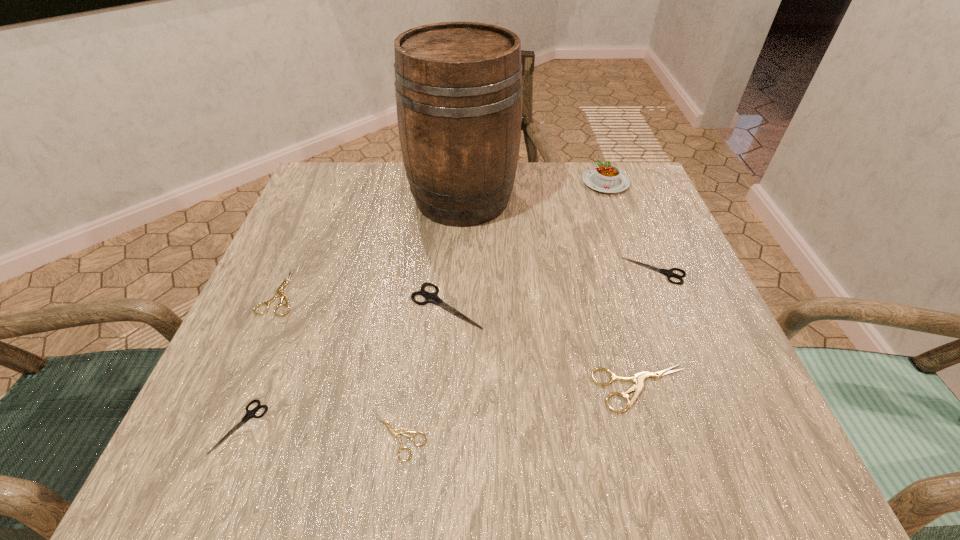
The image size is (960, 540). I want to click on the shortest shears, so pyautogui.click(x=395, y=433).

The width and height of the screenshot is (960, 540). In order to click on the shortest object in this screenshot , I will do `click(395, 433)`.

You are a GUI agent. You are given a task and a screenshot of the screen. Output one action in this format:
    pyautogui.click(x=<x>, y=<y>)
    Task: Click on the vacant region located on the side of the tallest object near the bung hole
    
    Given the screenshot: What is the action you would take?
    pyautogui.click(x=578, y=199)

Locate an element on the screen. The width and height of the screenshot is (960, 540). free space located on the front of the pudding is located at coordinates (626, 240).

Locate an element on the screen. vacant space located on the left of the second black shears from right to left is located at coordinates (294, 306).

This screenshot has width=960, height=540. I want to click on blank space located 0.100m on the back of the second biggest black shears, so click(637, 226).

Find the location of a particular element. blank space located 0.240m on the left of the biggest beige shears is located at coordinates (438, 388).

This screenshot has width=960, height=540. What are the coordinates of `vacant point located 0.200m on the back of the leftmost beige shears` in the screenshot? It's located at (317, 208).

Image resolution: width=960 pixels, height=540 pixels. I want to click on free space located on the right of the leftmost black shears, so click(297, 426).

In order to click on vacant space located 0.130m on the right of the second beige shears from right to left in this screenshot , I will do `click(518, 436)`.